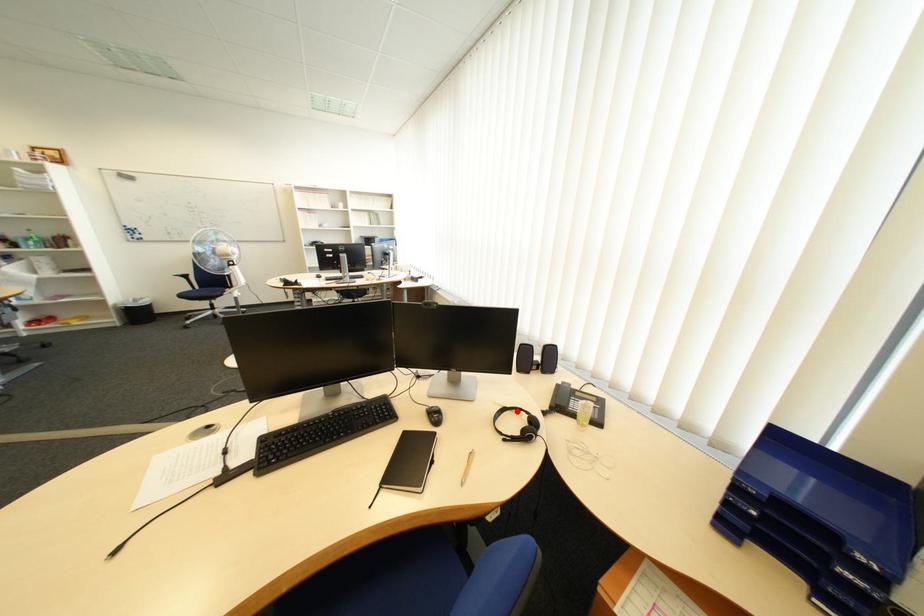
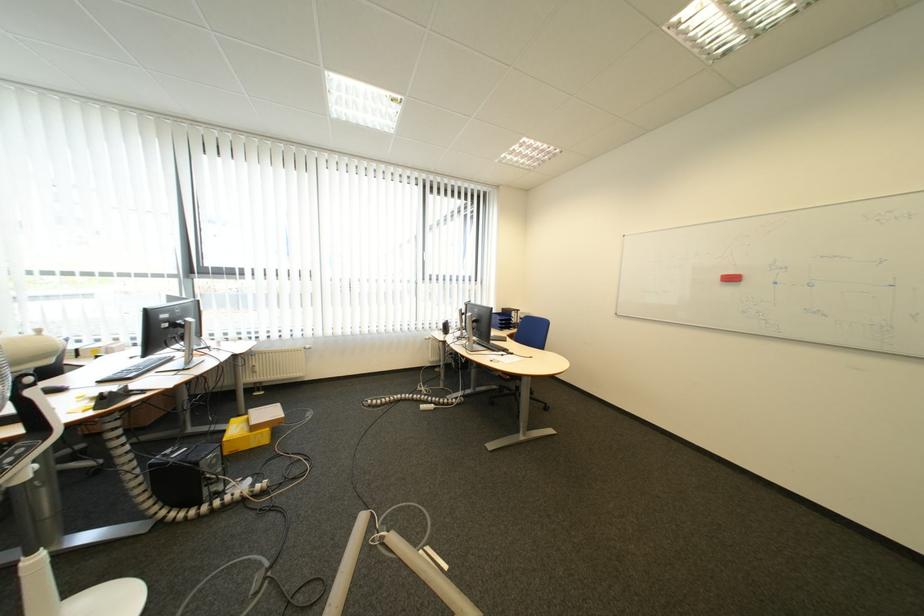
Question: I am providing you with two images of the same scene from different viewpoints. A red point is marked on the first image. At the location where the point appears in image 1, is it still visible in image 2?

Choices:
 (A) Yes
 (B) No

Answer: (B)